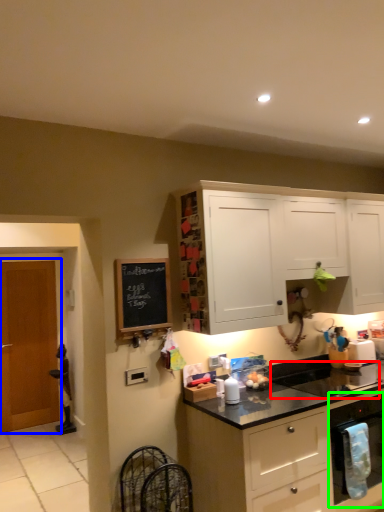
Question: Which object is the closest to the sink (highlighted by a red box)? Choose among these: door (highlighted by a blue box) or kitchen appliance (highlighted by a green box).

Choices:
 (A) door
 (B) kitchen appliance

Answer: (B)